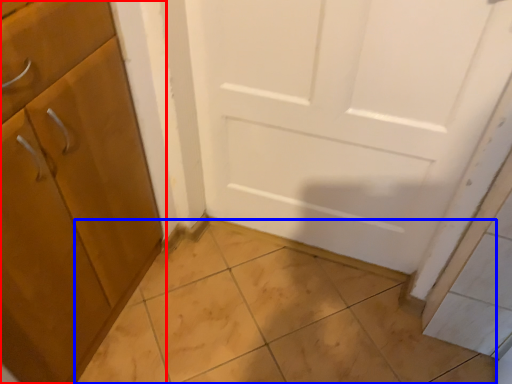
Question: Among these objects, which one is farthest to the camera, cabinetry (highlighted by a red box) or tile (highlighted by a blue box)?

Choices:
 (A) cabinetry
 (B) tile

Answer: (B)